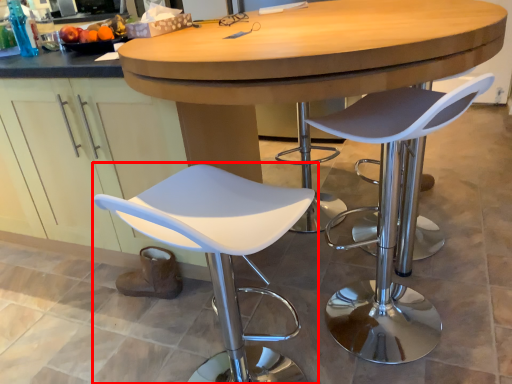
Question: From the image's perspective, where is chair (annotated by the red box) located in relation to chair in the image?

Choices:
 (A) above
 (B) below

Answer: (B)